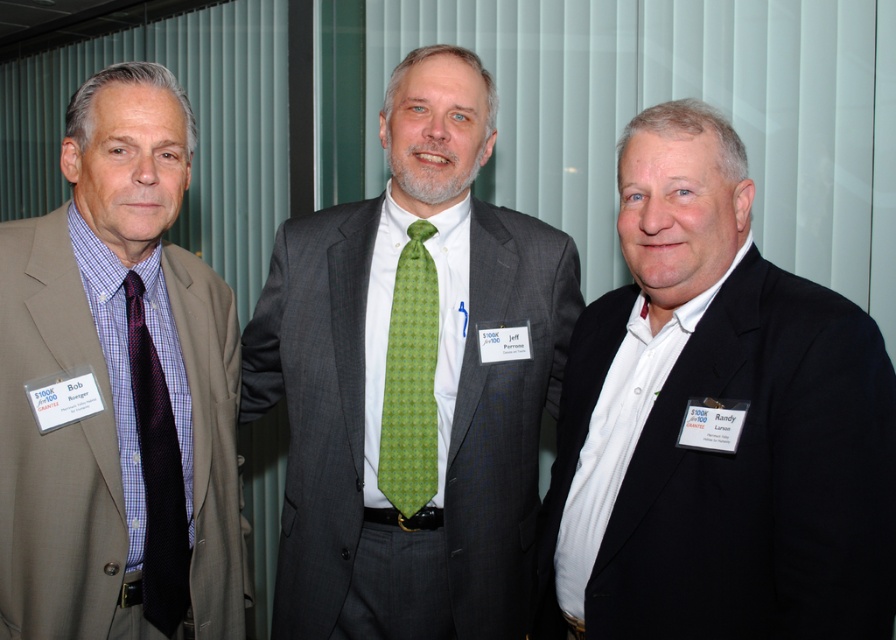
You are a photographer at a formal event. You need to capture a photo where the green printed tie at center and the dark blue textured tie at left are clearly visible. Based on their positions, which tie will appear higher in the photo?

The green printed tie at center will appear higher in the photo because it is located above the dark blue textured tie at left.

You are a photographer preparing to take a group photo of the three men. You need to ensure that the matte brown suit at left and the dark blue textured tie at left are clearly visible in the photo. Given their current distance apart, will you need to adjust the camera focus to capture both details simultaneously?

The matte brown suit at left and dark blue textured tie at left are 3.39 inches apart. Since they are close enough, the camera focus can capture both details without needing adjustment.

You are a photographer at a formal event and need to capture a photo of the two men with the green printed tie at center and dark blue textured tie at left. Based on their positions, which man should you focus on first to ensure both are in frame?

The green printed tie at center is to the right of the dark blue textured tie at left, so you should focus on the man with the dark blue textured tie at left first to ensure both are in frame since he is positioned to the left of the central figure.